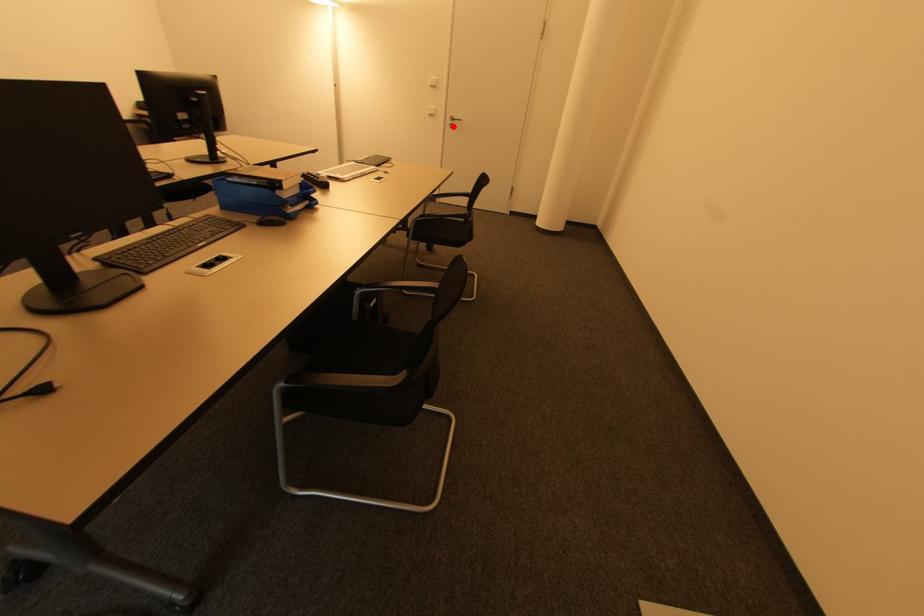
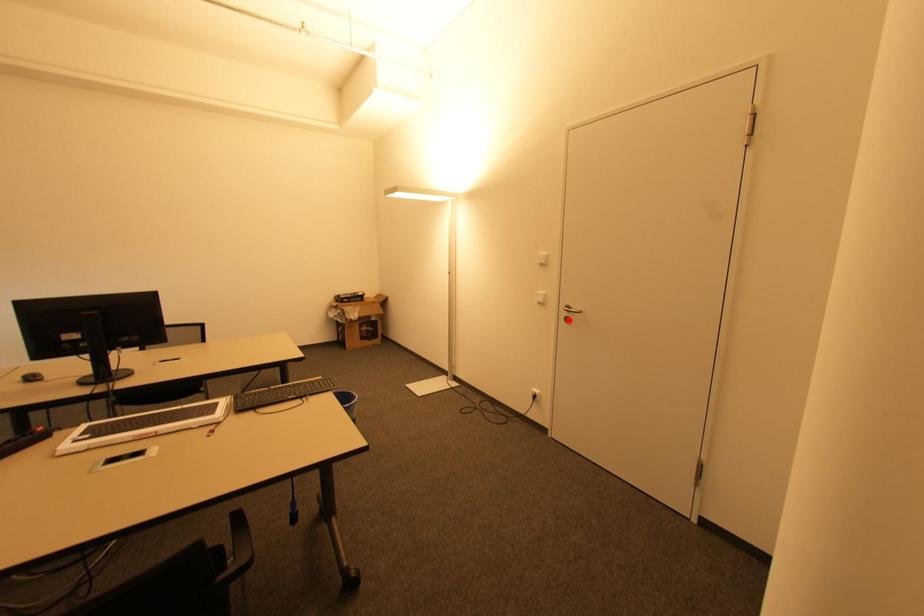
I am providing you with two images of the same scene from different viewpoints. A red point is marked on the first image and another point is marked on the second image. Is the marked point in image1 the same physical position as the marked point in image2?

Yes